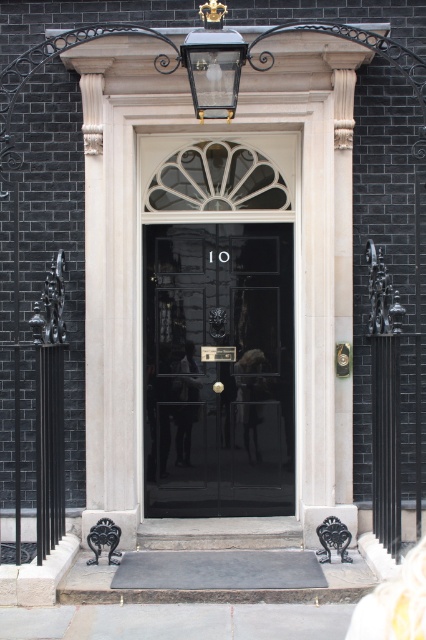
Question: Can you confirm if glossy black door at center is smaller than clear glass lantern at upper center?

Choices:
 (A) no
 (B) yes

Answer: (A)

Question: Does glossy black door at center appear on the right side of clear glass lantern at upper center?

Choices:
 (A) yes
 (B) no

Answer: (A)

Question: Is glossy black door at center bigger than clear glass lantern at upper center?

Choices:
 (A) yes
 (B) no

Answer: (A)

Question: Among these points, which one is nearest to the camera?

Choices:
 (A) (250, 230)
 (B) (227, 102)

Answer: (B)